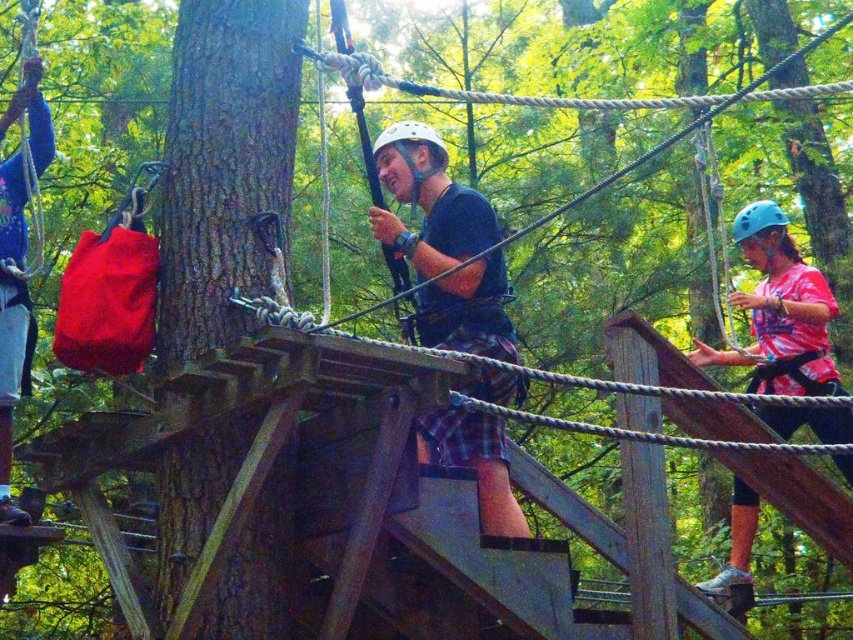
Question: Can you confirm if blue fabric bag at left is smaller than blue matte helmet at upper right?

Choices:
 (A) yes
 (B) no

Answer: (B)

Question: Is plaid fabric shorts at center further to camera compared to white matte helmet at center?

Choices:
 (A) no
 (B) yes

Answer: (A)

Question: Does blue fabric bag at left have a smaller size compared to wooden bridge at center?

Choices:
 (A) yes
 (B) no

Answer: (A)

Question: Which object appears closest to the camera in this image?

Choices:
 (A) smooth bark tree at left
 (B) white matte helmet at center
 (C) blue matte helmet at upper right
 (D) blue fabric bag at left

Answer: (A)

Question: Which object is farther from the camera taking this photo?

Choices:
 (A) blue matte helmet at upper right
 (B) plaid fabric shorts at center
 (C) smooth bark tree at left
 (D) wooden bridge at center

Answer: (A)

Question: Estimate the real-world distances between objects in this image. Which object is farther from the blue fabric bag at left?

Choices:
 (A) blue matte helmet at upper right
 (B) wooden bridge at center
 (C) white matte helmet at center

Answer: (A)